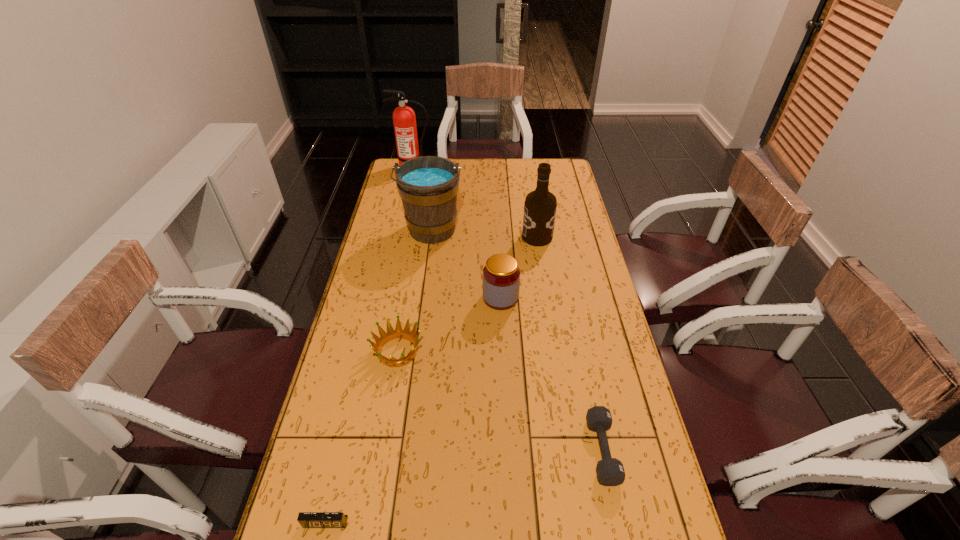
Image resolution: width=960 pixels, height=540 pixels. What are the coordinates of `alarm clock` in the screenshot? It's located at (306, 519).

The image size is (960, 540). Identify the location of the nearest object. (306, 519).

At what (x,y) coordinates should I click in order to perform the action: click on vacant space positioned on the handle side of the fire extinguisher. Please return your answer as a coordinate pair (x, y). The image size is (960, 540). Looking at the image, I should click on (401, 217).

Where is `vacant region located on the label of the alcohol`? Image resolution: width=960 pixels, height=540 pixels. vacant region located on the label of the alcohol is located at coordinates (467, 237).

In order to click on vacant space located on the label of the alcohol in this screenshot , I will do coord(487,237).

This screenshot has height=540, width=960. I want to click on vacant region located on the label of the alcohol, so click(499, 237).

The height and width of the screenshot is (540, 960). What are the coordinates of `vacant space located with a handle on the side of the wine bucket` in the screenshot? It's located at (423, 299).

You are a GUI agent. You are given a task and a screenshot of the screen. Output one action in this format:
    pyautogui.click(x=<x>, y=<y>)
    Task: Click on the blank area located 0.290m on the right of the fourth farthest object
    The height and width of the screenshot is (540, 960).
    Given the screenshot: What is the action you would take?
    pyautogui.click(x=604, y=298)

Where is `vacant space located on the back of the third nearest object`? This screenshot has height=540, width=960. vacant space located on the back of the third nearest object is located at coordinates (405, 308).

The width and height of the screenshot is (960, 540). Find the location of `vacant space located 0.380m on the back of the dumbbell`. vacant space located 0.380m on the back of the dumbbell is located at coordinates (573, 312).